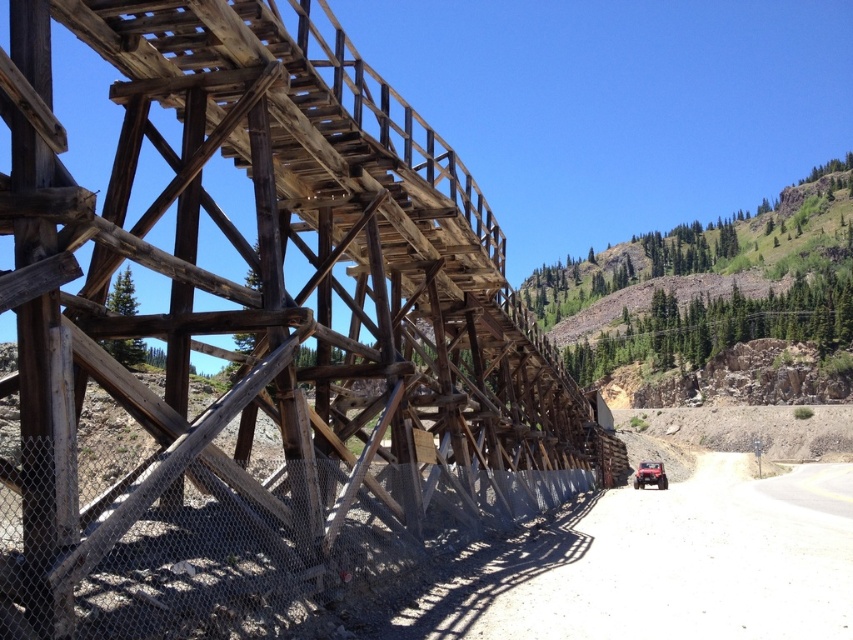
Can you confirm if weathered wood train bridge at center is positioned above rubberized matte red car at lower right?

Correct, weathered wood train bridge at center is located above rubberized matte red car at lower right.

Is weathered wood train bridge at center closer to the viewer compared to rubberized matte red car at lower right?

Yes, weathered wood train bridge at center is closer to the viewer.

You are a GUI agent. You are given a task and a screenshot of the screen. Output one action in this format:
    pyautogui.click(x=<x>, y=<y>)
    Task: Click on the weathered wood train bridge at center
    This screenshot has height=640, width=853.
    Given the screenshot: What is the action you would take?
    pyautogui.click(x=256, y=333)

The height and width of the screenshot is (640, 853). In order to click on weathered wood train bridge at center in this screenshot , I will do `click(256, 333)`.